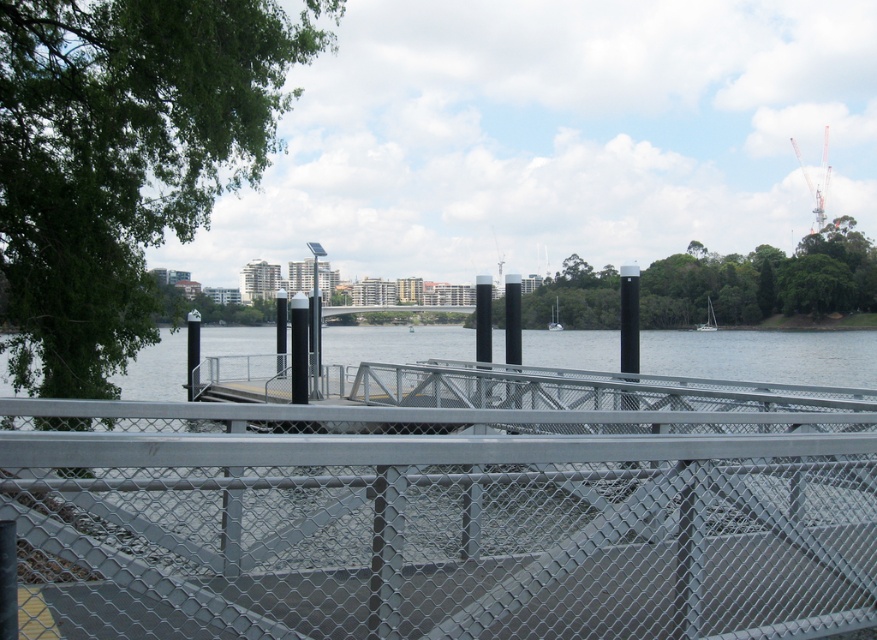
You are standing on the walkway and see the metal mesh fence at center and the white matte sailboat at center. Which object is bigger in size?

The metal mesh fence at center is larger in size compared to the white matte sailboat at center.